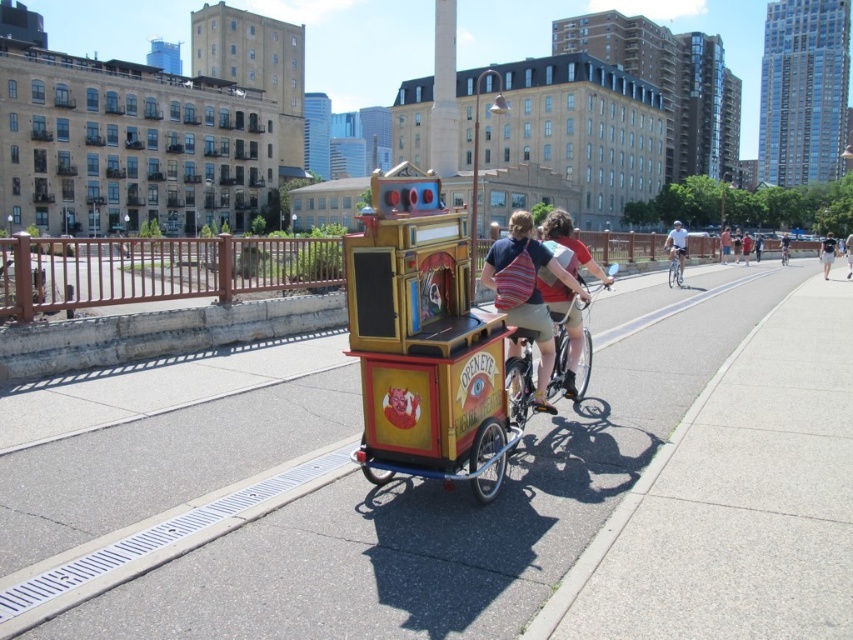
From the picture: Can you confirm if silver metallic bicycle at center is positioned above white cotton shirt at center?

No.

Locate an element on the screen. This screenshot has width=853, height=640. silver metallic bicycle at center is located at coordinates (675, 264).

Identify the location of striped fabric backpack at center. The height and width of the screenshot is (640, 853). (527, 291).

Which of these two, striped fabric backpack at center or white cotton shirt at center, stands shorter?

striped fabric backpack at center

Locate an element on the screen. striped fabric backpack at center is located at coordinates (527, 291).

At what (x,y) coordinates should I click in order to perform the action: click on striped fabric backpack at center. Please return your answer as a coordinate pair (x, y). The image size is (853, 640). Looking at the image, I should click on (527, 291).

Is metallic silver bicycle at center positioned in front of light brown leather jacket at center?

That is True.

Does metallic silver bicycle at center have a lesser width compared to light brown leather jacket at center?

Correct, metallic silver bicycle at center's width is less than light brown leather jacket at center's.

Which is in front, point (555, 387) or point (846, 252)?

Positioned in front is point (555, 387).

The width and height of the screenshot is (853, 640). Find the location of `metallic silver bicycle at center`. metallic silver bicycle at center is located at coordinates (567, 353).